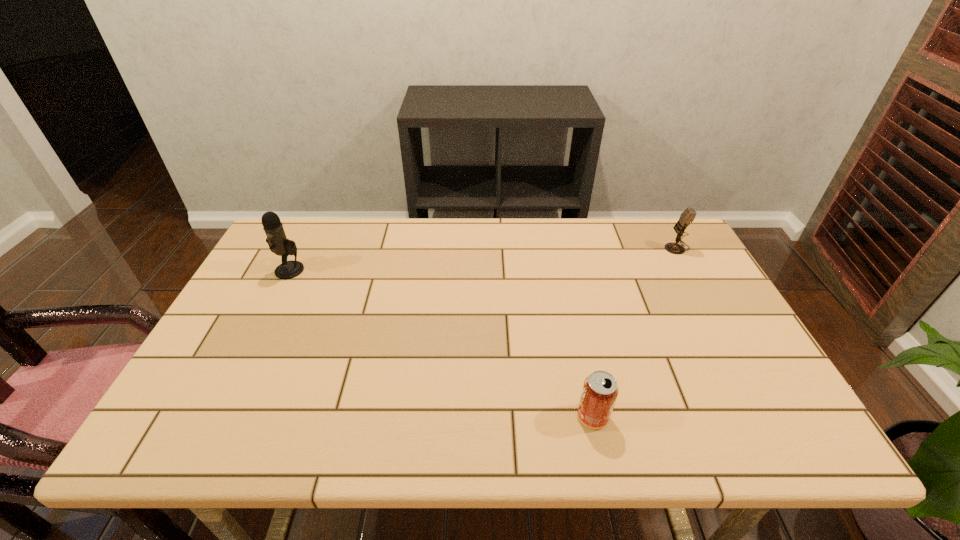
Where is `vacant space that's between the second nearest object and the rightmost object`? vacant space that's between the second nearest object and the rightmost object is located at coordinates (483, 259).

What are the coordinates of `object that is the closest to the farther microphone` in the screenshot? It's located at (600, 390).

You are a GUI agent. You are given a task and a screenshot of the screen. Output one action in this format:
    pyautogui.click(x=<x>, y=<y>)
    Task: Click on the object that is the closest to the tallest object
    
    Given the screenshot: What is the action you would take?
    pyautogui.click(x=600, y=390)

The height and width of the screenshot is (540, 960). I want to click on blank area in the image that satisfies the following two spatial constraints: 1. on the front-facing side of the farther microphone; 2. on the front side of the taller microphone, so click(x=689, y=270).

The image size is (960, 540). Identify the location of free space that satisfies the following two spatial constraints: 1. on the front side of the left microphone; 2. on the right side of the second object from right to left. (216, 416).

In order to click on free spot that satisfies the following two spatial constraints: 1. on the front-facing side of the rightmost object; 2. on the front side of the shortest object in this screenshot , I will do `click(771, 416)`.